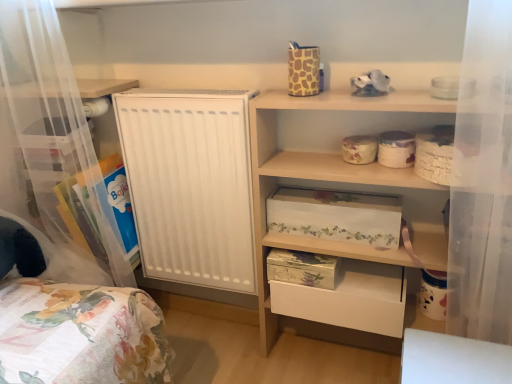
Where is `white matte drawer at lower center`? The width and height of the screenshot is (512, 384). white matte drawer at lower center is located at coordinates (349, 298).

Where is `floral-patterned cardboard box at center, the second storage box positioned from the top`? This screenshot has height=384, width=512. floral-patterned cardboard box at center, the second storage box positioned from the top is located at coordinates (336, 216).

The width and height of the screenshot is (512, 384). Describe the element at coordinates (60, 186) in the screenshot. I see `clear plastic storage at left, which is the 1th shelf in left-to-right order` at that location.

Describe the element at coordinates (396, 149) in the screenshot. I see `floral-patterned cardboard box at upper center, acting as the 1th storage box starting from the top` at that location.

At what (x,y) coordinates should I click in order to perform the action: click on white matte drawer at lower center. Please return your answer as a coordinate pair (x, y). This screenshot has width=512, height=384. Looking at the image, I should click on (349, 298).

Is clear plastic storage at left, which is the 1th shelf in left-to-right order, placed right next to wooden shelf at upper right, arranged as the 2th shelf when viewed from the left?

No, clear plastic storage at left, which is the 1th shelf in left-to-right order, is not touching wooden shelf at upper right, arranged as the 2th shelf when viewed from the left.

Considering the relative positions of clear plastic storage at left, which is the 1th shelf in left-to-right order, and wooden shelf at upper right, arranged as the 2th shelf when viewed from the left, in the image provided, is clear plastic storage at left, which is the 1th shelf in left-to-right order, to the left of wooden shelf at upper right, arranged as the 2th shelf when viewed from the left, from the viewer's perspective?

Yes, clear plastic storage at left, which is the 1th shelf in left-to-right order, is to the left of wooden shelf at upper right, arranged as the 2th shelf when viewed from the left.

Considering the points (69, 178) and (277, 130), which point is in front, point (69, 178) or point (277, 130)?

Positioned in front is point (277, 130).

Is white matte drawer at lower center turned away from floral-patterned cardboard box at center, the second storage box positioned from the top?

white matte drawer at lower center does not have its back to floral-patterned cardboard box at center, the second storage box positioned from the top.

Can you tell me how much white matte drawer at lower center and floral-patterned cardboard box at center, which is the second storage box in bottom-to-top order, differ in facing direction?

The angle between the facing direction of white matte drawer at lower center and the facing direction of floral-patterned cardboard box at center, which is the second storage box in bottom-to-top order, is 0.67 degrees.

Identify the location of storage box that is the 1st object to the left of the white matte drawer at lower center, starting at the anchor. (336, 216).

Would you say white matte drawer at lower center is to the left or to the right of floral-patterned cardboard box at center, which is the second storage box in bottom-to-top order, in the picture?

white matte drawer at lower center is positioned on floral-patterned cardboard box at center, which is the second storage box in bottom-to-top order,'s right side.

Considering the positions of point (414, 153) and point (314, 226), is point (414, 153) closer or farther from the camera than point (314, 226)?

Clearly, point (414, 153) is closer to the camera than point (314, 226).

Between floral-patterned cardboard box at upper center, acting as the 1th storage box starting from the top, and floral-patterned cardboard box at center, which is the second storage box in bottom-to-top order, which one has larger size?

Bigger between the two is floral-patterned cardboard box at center, which is the second storage box in bottom-to-top order.

Is floral-patterned cardboard box at upper center, acting as the 1th storage box starting from the top, positioned before floral-patterned cardboard box at center, the second storage box positioned from the top?

Yes, floral-patterned cardboard box at upper center, acting as the 1th storage box starting from the top, is closer to the viewer.

Looking at this image, from a real-world perspective, who is located lower, floral-patterned cardboard box at upper center, acting as the 1th storage box starting from the top, or floral-patterned cardboard box at center, the second storage box positioned from the top?

floral-patterned cardboard box at center, the second storage box positioned from the top, is physically lower.

Which object is further away from the camera taking this photo, floral-patterned cardboard box at upper center, acting as the 1th storage box starting from the top, or floral paper storage box at lower center, which is counted as the third storage box, starting from the top?

floral paper storage box at lower center, which is counted as the third storage box, starting from the top.

Between point (378, 158) and point (279, 254), which one is positioned in front?

The point (378, 158) is in front.

Is floral paper storage box at lower center, which is counted as the third storage box, starting from the top, at the back of floral-patterned cardboard box at upper center, the third storage box ordered from the bottom?

No.

Can you tell me how much clear plastic storage at left, which is the second shelf from right to left, and white matte drawer at lower center differ in facing direction?

There is a 0.097-degree angle between the facing directions of clear plastic storage at left, which is the second shelf from right to left, and white matte drawer at lower center.

Is point (65, 227) behind point (362, 323)?

Yes, point (65, 227) is behind point (362, 323).

Which of these two, clear plastic storage at left, which is the 1th shelf in left-to-right order, or white matte drawer at lower center, is thinner?

Thinner between the two is white matte drawer at lower center.

Which is in front, clear plastic storage at left, which is the 1th shelf in left-to-right order, or white matte drawer at lower center?

clear plastic storage at left, which is the 1th shelf in left-to-right order, is closer to the camera.

Is the surface of floral-patterned cardboard box at upper center, acting as the 1th storage box starting from the top, in direct contact with clear plastic storage at left, which is the 1th shelf in left-to-right order?

No, floral-patterned cardboard box at upper center, acting as the 1th storage box starting from the top, is not with clear plastic storage at left, which is the 1th shelf in left-to-right order.

Considering the relative sizes of floral-patterned cardboard box at upper center, acting as the 1th storage box starting from the top, and clear plastic storage at left, which is the 1th shelf in left-to-right order, in the image provided, is floral-patterned cardboard box at upper center, acting as the 1th storage box starting from the top, shorter than clear plastic storage at left, which is the 1th shelf in left-to-right order,?

Indeed, floral-patterned cardboard box at upper center, acting as the 1th storage box starting from the top, has a lesser height compared to clear plastic storage at left, which is the 1th shelf in left-to-right order.

Is point (406, 141) closer or farther from the camera than point (6, 139)?

Point (406, 141) is closer to the camera than point (6, 139).

Based on the photo, is floral-patterned cardboard box at upper center, the third storage box ordered from the bottom, oriented away from clear plastic storage at left, which is the 1th shelf in left-to-right order?

No, floral-patterned cardboard box at upper center, the third storage box ordered from the bottom, is not facing away from clear plastic storage at left, which is the 1th shelf in left-to-right order.

Between wooden shelf at upper right, arranged as the 2th shelf when viewed from the left, and clear plastic storage at left, which is the 1th shelf in left-to-right order, which one has less height?

wooden shelf at upper right, arranged as the 2th shelf when viewed from the left, is shorter.

Which is correct: wooden shelf at upper right, arranged as the 2th shelf when viewed from the left, is inside clear plastic storage at left, which is the 1th shelf in left-to-right order, or outside of it?

wooden shelf at upper right, arranged as the 2th shelf when viewed from the left, exists outside the volume of clear plastic storage at left, which is the 1th shelf in left-to-right order.

From a real-world perspective, does wooden shelf at upper right, arranged as the 2th shelf when viewed from the left, stand above clear plastic storage at left, which is the second shelf from right to left?

No, from a real-world perspective, wooden shelf at upper right, arranged as the 2th shelf when viewed from the left, is not over clear plastic storage at left, which is the second shelf from right to left

Can you tell me how much wooden shelf at upper right, arranged as the 2th shelf when viewed from the left, and clear plastic storage at left, which is the 1th shelf in left-to-right order, differ in facing direction?

They differ by 0.278 degrees in their facing directions.

Where is `shelf in front of the clear plastic storage at left, which is the second shelf from right to left`? This screenshot has width=512, height=384. shelf in front of the clear plastic storage at left, which is the second shelf from right to left is located at coordinates (322, 174).

The height and width of the screenshot is (384, 512). In order to click on drawer behind the floral-patterned cardboard box at center, which is the second storage box in bottom-to-top order in this screenshot , I will do `click(349, 298)`.

Based on their spatial positions, is clear plastic storage at left, which is the second shelf from right to left, or wooden shelf at upper right, arranged as the 2th shelf when viewed from the left, further from white matte drawer at lower center?

clear plastic storage at left, which is the second shelf from right to left, is positioned further to the anchor white matte drawer at lower center.

Based on their spatial positions, is floral-patterned cardboard box at center, which is the second storage box in bottom-to-top order, or wooden shelf at upper right, arranged as the 2th shelf when viewed from the left, closer to floral paper storage box at lower center, which is counted as the third storage box, starting from the top?

floral-patterned cardboard box at center, which is the second storage box in bottom-to-top order, is positioned closer to the anchor floral paper storage box at lower center, which is counted as the third storage box, starting from the top.

Which object lies nearer to the anchor point floral paper storage box at lower center, which is counted as the third storage box, starting from the top, floral-patterned cardboard box at upper center, acting as the 1th storage box starting from the top, or floral-patterned cardboard box at center, which is the second storage box in bottom-to-top order?

Among the two, floral-patterned cardboard box at center, which is the second storage box in bottom-to-top order, is located nearer to floral paper storage box at lower center, which is counted as the third storage box, starting from the top.

Considering their positions, is floral-patterned cardboard box at upper center, the third storage box ordered from the bottom, positioned closer to clear plastic storage at left, which is the second shelf from right to left, than wooden shelf at upper right, arranged as the 2th shelf when viewed from the left?

wooden shelf at upper right, arranged as the 2th shelf when viewed from the left.

Based on their spatial positions, is clear plastic storage at left, which is the second shelf from right to left, or white matte drawer at lower center closer to floral-patterned cardboard box at upper center, acting as the 1th storage box starting from the top?

white matte drawer at lower center is positioned closer to the anchor floral-patterned cardboard box at upper center, acting as the 1th storage box starting from the top.

Based on their spatial positions, is white matte drawer at lower center or floral-patterned cardboard box at center, which is the second storage box in bottom-to-top order, further from floral paper storage box at lower center, which is the 1th storage box from bottom to top?

floral-patterned cardboard box at center, which is the second storage box in bottom-to-top order, lies further to floral paper storage box at lower center, which is the 1th storage box from bottom to top, than the other object.

When comparing their distances from clear plastic storage at left, which is the 1th shelf in left-to-right order, does floral paper storage box at lower center, which is counted as the third storage box, starting from the top, or white matte drawer at lower center seem closer?

floral paper storage box at lower center, which is counted as the third storage box, starting from the top, is positioned closer to the anchor clear plastic storage at left, which is the 1th shelf in left-to-right order.

Looking at the image, which one is located further to white matte drawer at lower center, wooden shelf at upper right, arranged as the 2th shelf when viewed from the left, or clear plastic storage at left, which is the second shelf from right to left?

The object further to white matte drawer at lower center is clear plastic storage at left, which is the second shelf from right to left.

Locate an element on the screen. This screenshot has width=512, height=384. storage box between floral-patterned cardboard box at center, the second storage box positioned from the top, and white matte drawer at lower center in the up-down direction is located at coordinates (303, 268).

Where is `storage box between floral-patterned cardboard box at upper center, the third storage box ordered from the bottom, and wooden shelf at upper right, arranged as the 2th shelf when viewed from the left, in the vertical direction`? Image resolution: width=512 pixels, height=384 pixels. storage box between floral-patterned cardboard box at upper center, the third storage box ordered from the bottom, and wooden shelf at upper right, arranged as the 2th shelf when viewed from the left, in the vertical direction is located at coordinates (336, 216).

Find the location of a particular element. Image resolution: width=512 pixels, height=384 pixels. storage box between floral-patterned cardboard box at upper center, acting as the 1th storage box starting from the top, and floral paper storage box at lower center, which is the 1th storage box from bottom to top, from top to bottom is located at coordinates (336, 216).

Where is `drawer between wooden shelf at upper right, arranged as the 2th shelf when viewed from the left, and floral paper storage box at lower center, which is the 1th storage box from bottom to top, from front to back`? drawer between wooden shelf at upper right, arranged as the 2th shelf when viewed from the left, and floral paper storage box at lower center, which is the 1th storage box from bottom to top, from front to back is located at coordinates (349, 298).